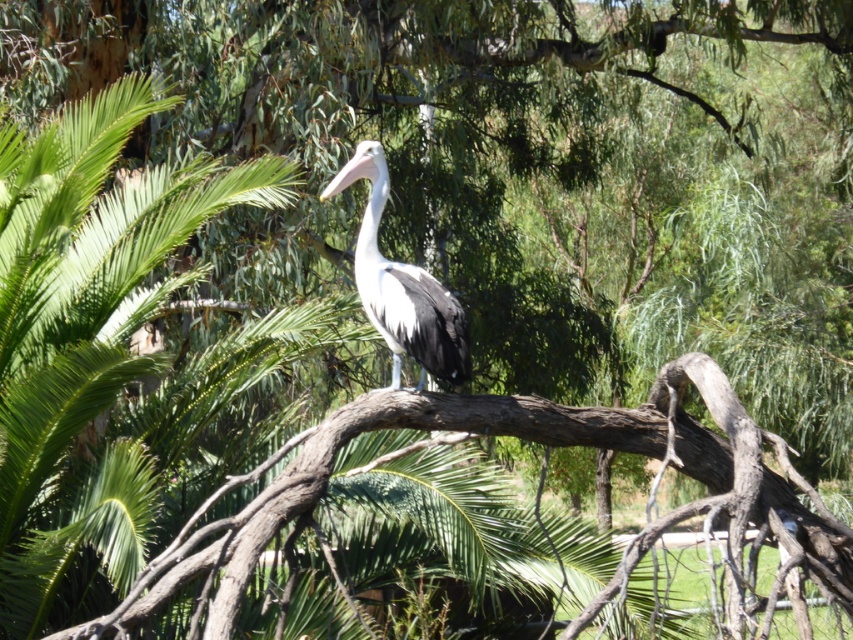
From the picture: Which of these two, green leafy palm tree at upper left or white glossy pelican at center, stands shorter?

Standing shorter between the two is white glossy pelican at center.

Is point (55, 541) positioned behind point (338, 179)?

Yes, point (55, 541) is behind point (338, 179).

The image size is (853, 640). What are the coordinates of `green leafy palm tree at upper left` in the screenshot? It's located at (88, 326).

Who is shorter, green leafy palm tree at upper left or brown rough tree branch at center?

With less height is brown rough tree branch at center.

Is green leafy palm tree at upper left shorter than brown rough tree branch at center?

No, green leafy palm tree at upper left is not shorter than brown rough tree branch at center.

Between point (68, 449) and point (508, 410), which one is positioned behind?

Point (68, 449)

I want to click on green leafy palm tree at upper left, so click(88, 326).

Between brown rough tree branch at center and white glossy pelican at center, which one appears on the left side from the viewer's perspective?

Positioned to the left is white glossy pelican at center.

Measure the distance from brown rough tree branch at center to white glossy pelican at center.

92.49 centimeters

Image resolution: width=853 pixels, height=640 pixels. What do you see at coordinates (540, 442) in the screenshot? I see `brown rough tree branch at center` at bounding box center [540, 442].

Locate an element on the screen. brown rough tree branch at center is located at coordinates (540, 442).